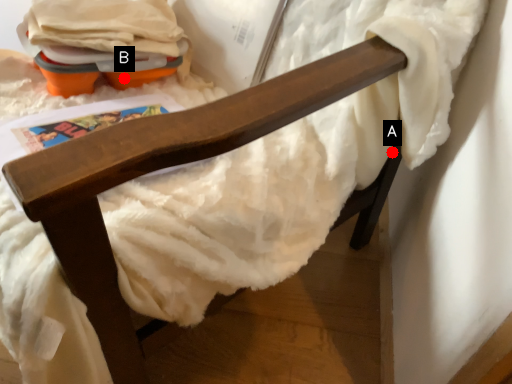
Question: Two points are circled on the image, labeled by A and B beside each circle. Among these points, which one is nearest to the camera?

Choices:
 (A) A is closer
 (B) B is closer

Answer: (A)